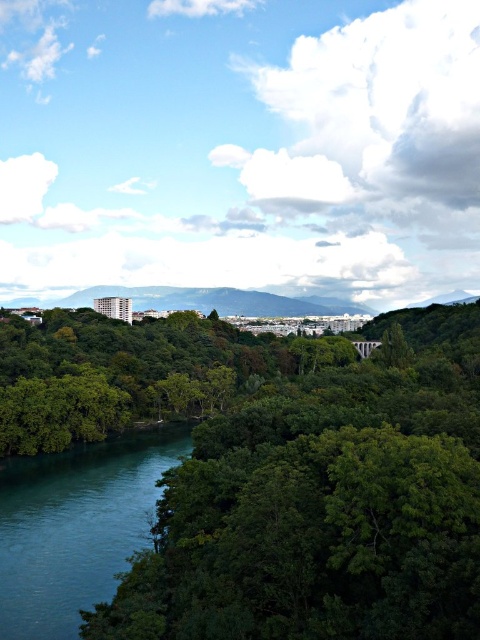
Question: Does green leafy tree at center appear over teal smooth water at lower left?

Choices:
 (A) yes
 (B) no

Answer: (A)

Question: Is green leafy tree at center closer to the viewer compared to teal smooth water at lower left?

Choices:
 (A) no
 (B) yes

Answer: (B)

Question: Which point is farther to the camera?

Choices:
 (A) (23, 618)
 (B) (190, 456)

Answer: (B)

Question: Which point appears closest to the camera in this image?

Choices:
 (A) (78, 582)
 (B) (335, 618)

Answer: (B)

Question: Which object is farther from the camera taking this photo?

Choices:
 (A) teal smooth water at lower left
 (B) green leafy tree at center

Answer: (A)

Question: Does green leafy tree at center come behind teal smooth water at lower left?

Choices:
 (A) no
 (B) yes

Answer: (A)